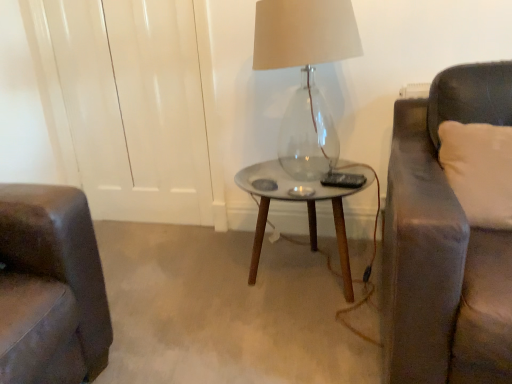
This screenshot has height=384, width=512. What do you see at coordinates (305, 74) in the screenshot?
I see `translucent glass lamp at center` at bounding box center [305, 74].

What are the coordinates of `translucent glass lamp at center` in the screenshot? It's located at (305, 74).

From the image's perspective, which one is positioned lower, metallic silver table at center or white soft cushion at right?

From the image's view, metallic silver table at center is below.

Would you say metallic silver table at center is to the left or to the right of white soft cushion at right in the picture?

Based on their positions, metallic silver table at center is located to the left of white soft cushion at right.

Consider the image. Can you confirm if metallic silver table at center is taller than white soft cushion at right?

Correct, metallic silver table at center is much taller as white soft cushion at right.

How different are the orientations of translucent glass lamp at center and metallic silver table at center in degrees?

0.000558 degrees separate the facing orientations of translucent glass lamp at center and metallic silver table at center.

Could you tell me if translucent glass lamp at center is turned towards metallic silver table at center?

No, translucent glass lamp at center is not facing towards metallic silver table at center.

Is translucent glass lamp at center next to metallic silver table at center and touching it?

They are not placed beside each other.

Does translucent glass lamp at center have a lesser height compared to metallic silver table at center?

In fact, translucent glass lamp at center may be taller than metallic silver table at center.

Considering the sizes of objects translucent glass lamp at center and white soft cushion at right in the image provided, who is wider, translucent glass lamp at center or white soft cushion at right?

Wider between the two is translucent glass lamp at center.

Based on their positions, is translucent glass lamp at center located to the left or right of white soft cushion at right?

translucent glass lamp at center is to the left of white soft cushion at right.

You are a GUI agent. You are given a task and a screenshot of the screen. Output one action in this format:
    pyautogui.click(x=<x>, y=<y>)
    Task: Click on the lamp located behind the white soft cushion at right
    The height and width of the screenshot is (384, 512).
    Given the screenshot: What is the action you would take?
    click(305, 74)

Are metallic silver table at center and translucent glass lamp at center far apart?

No.

Is metallic silver table at center turned away from translucent glass lamp at center?

No, metallic silver table at center's orientation is not away from translucent glass lamp at center.

Who is bigger, metallic silver table at center or translucent glass lamp at center?

metallic silver table at center.

How distant is metallic silver table at center from translucent glass lamp at center?

A distance of 10.37 inches exists between metallic silver table at center and translucent glass lamp at center.

Is point (511, 227) less distant than point (257, 241)?

Yes, point (511, 227) is closer to viewer.

Does white soft cushion at right lie behind metallic silver table at center?

No, the depth of white soft cushion at right is less than that of metallic silver table at center.

Can we say white soft cushion at right lies outside metallic silver table at center?

That's correct, white soft cushion at right is outside of metallic silver table at center.

Which object is positioned more to the left, white soft cushion at right or metallic silver table at center?

From the viewer's perspective, metallic silver table at center appears more on the left side.

Is point (477, 142) closer to viewer compared to point (349, 50)?

Yes, point (477, 142) is in front of point (349, 50).

Is white soft cushion at right to the left of translucent glass lamp at center from the viewer's perspective?

→ In fact, white soft cushion at right is to the right of translucent glass lamp at center.

Is white soft cushion at right next to translucent glass lamp at center?

No, white soft cushion at right is not with translucent glass lamp at center.

From the image's perspective, would you say white soft cushion at right is positioned over translucent glass lamp at center?

No.

Find the location of `pillow above the metallic silver table at center (from the image's perspective)`. pillow above the metallic silver table at center (from the image's perspective) is located at coordinates (479, 171).

At what (x,y) coordinates should I click in order to perform the action: click on lamp in front of the metallic silver table at center. Please return your answer as a coordinate pair (x, y). This screenshot has width=512, height=384. Looking at the image, I should click on (305, 74).

Which object lies further to the anchor point translucent glass lamp at center, white soft cushion at right or metallic silver table at center?

Among the two, white soft cushion at right is located further to translucent glass lamp at center.

Which object lies nearer to the anchor point white soft cushion at right, translucent glass lamp at center or metallic silver table at center?

metallic silver table at center is closer to white soft cushion at right.

Looking at the image, which one is located further to metallic silver table at center, translucent glass lamp at center or white soft cushion at right?

white soft cushion at right is further to metallic silver table at center.

From the image, which object appears to be nearer to white soft cushion at right, metallic silver table at center or translucent glass lamp at center?

Based on the image, metallic silver table at center appears to be nearer to white soft cushion at right.

From the image, which object appears to be nearer to translucent glass lamp at center, metallic silver table at center or white soft cushion at right?

metallic silver table at center is closer to translucent glass lamp at center.

Based on their spatial positions, is white soft cushion at right or translucent glass lamp at center further from metallic silver table at center?

Based on the image, white soft cushion at right appears to be further to metallic silver table at center.

The width and height of the screenshot is (512, 384). I want to click on table situated between translucent glass lamp at center and white soft cushion at right from left to right, so click(x=300, y=201).